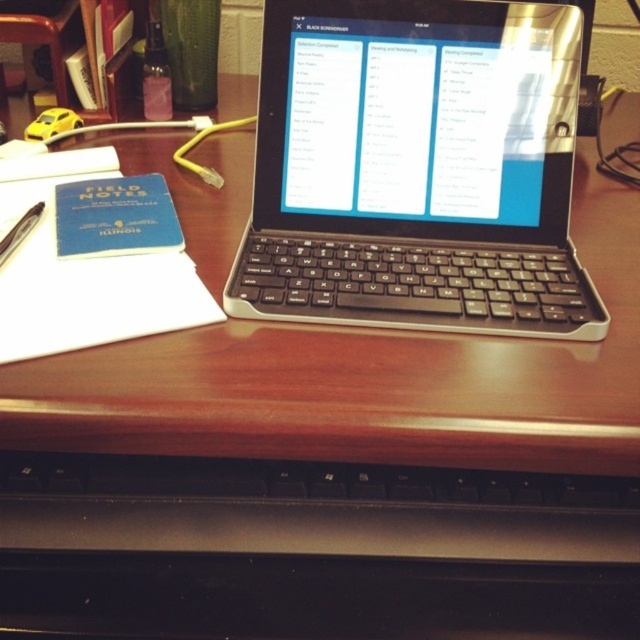
Question: Is wooden table at center wider than white paper at left?

Choices:
 (A) yes
 (B) no

Answer: (A)

Question: Is black plastic keyboard at center below white paper at left?

Choices:
 (A) no
 (B) yes

Answer: (A)

Question: Is black plastic keyboard at center thinner than metallic pen at left?

Choices:
 (A) yes
 (B) no

Answer: (B)

Question: Considering the real-world distances, which object is closest to the wooden table at center?

Choices:
 (A) white paper at left
 (B) black plastic keyboard at center
 (C) blue paper at left

Answer: (B)

Question: Considering the real-world distances, which object is farthest from the white paper at left?

Choices:
 (A) black plastic keyboard at center
 (B) blue paper at left
 (C) wooden table at center
 (D) metallic pen at left

Answer: (A)

Question: Which object is the closest to the white paper at left?

Choices:
 (A) black plastic keyboard at center
 (B) wooden table at center
 (C) metallic pen at left
 (D) blue paper at left

Answer: (D)